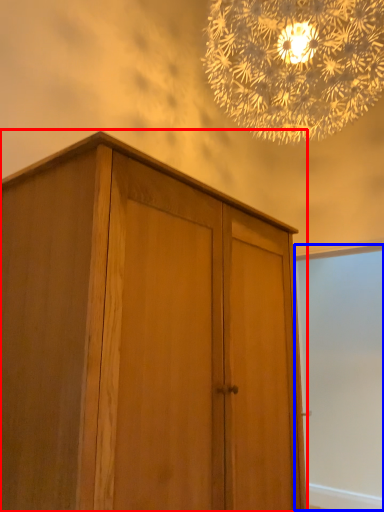
Question: Which object is closer to the camera taking this photo, cupboard (highlighted by a red box) or screen door (highlighted by a blue box)?

Choices:
 (A) cupboard
 (B) screen door

Answer: (A)